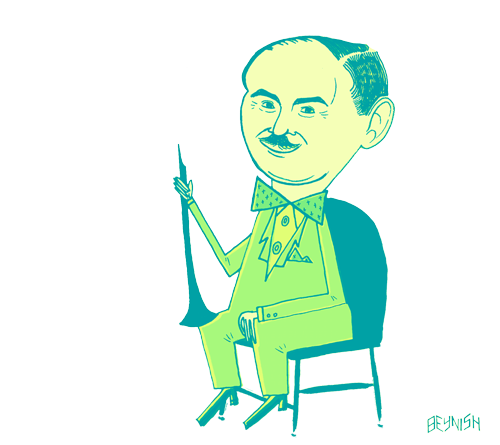
Locate an element on the screen. This screenshot has height=445, width=500. back of chair is located at coordinates (358, 264).